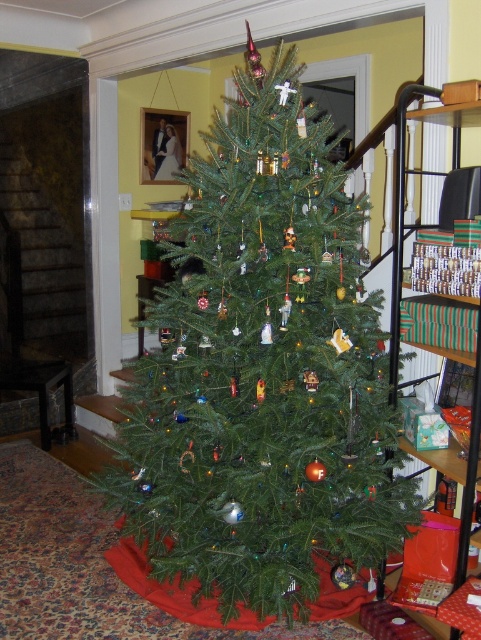
Is green matte christmas tree at center above green striped fabric at right?

No, green matte christmas tree at center is not above green striped fabric at right.

Is green matte christmas tree at center further to camera compared to green striped fabric at right?

Yes, it is behind green striped fabric at right.

The image size is (481, 640). What are the coordinates of `green matte christmas tree at center` in the screenshot? It's located at (261, 381).